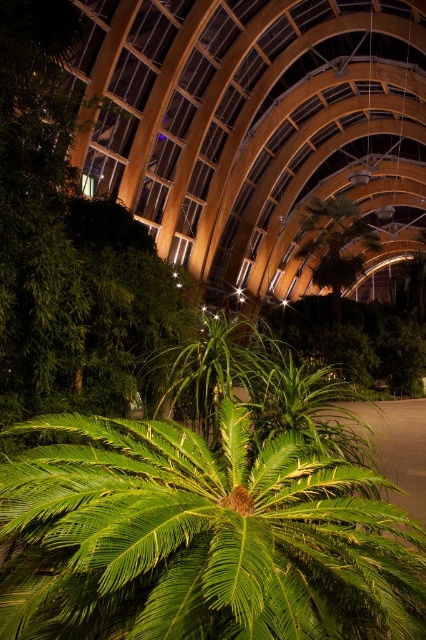
Between point (109, 564) and point (6, 388), which one is positioned behind?

The point (6, 388) is more distant.

Does green leafy palm tree at center appear over green leafy plant at center?

No.

Is point (219, 460) positioned after point (31, 364)?

No, it is not.

Locate an element on the screen. green leafy palm tree at center is located at coordinates (203, 538).